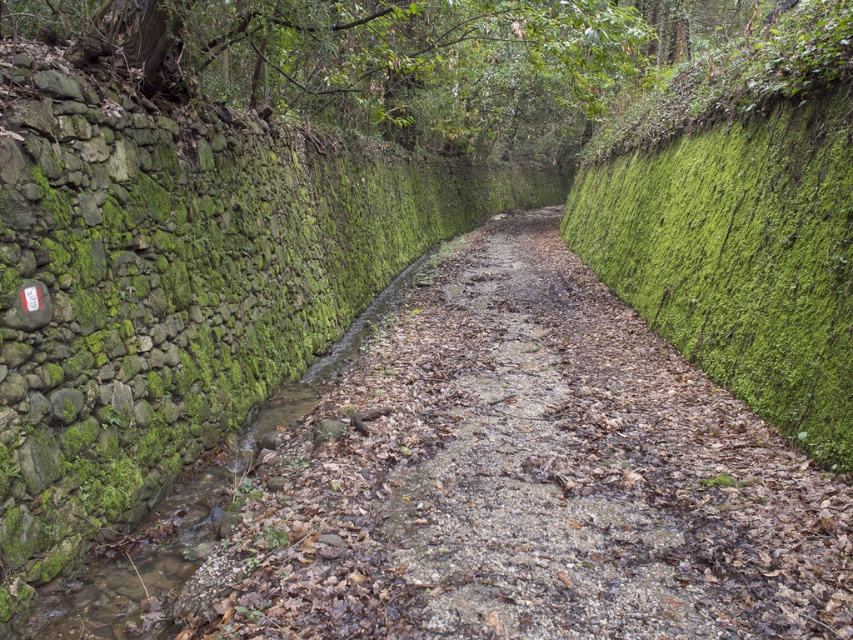
Question: Which object appears closest to the camera in this image?

Choices:
 (A) green mossy stone stream at left
 (B) green mossy hedge at right

Answer: (B)

Question: Which point appears farthest from the camera in this image?

Choices:
 (A) (749, 252)
 (B) (175, 541)

Answer: (A)

Question: Does green mossy hedge at right have a lesser width compared to green mossy stone stream at left?

Choices:
 (A) no
 (B) yes

Answer: (A)

Question: Can you confirm if green mossy hedge at right is thinner than green mossy stone stream at left?

Choices:
 (A) no
 (B) yes

Answer: (A)

Question: Does green mossy hedge at right appear under green mossy stone stream at left?

Choices:
 (A) yes
 (B) no

Answer: (B)